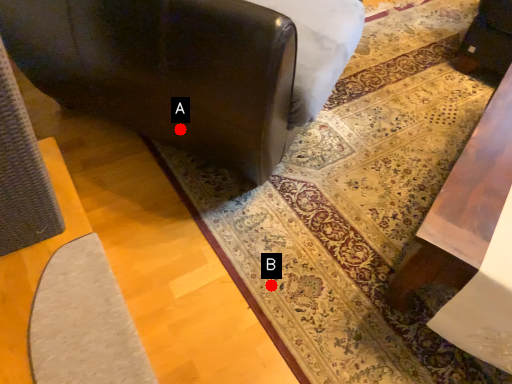
Question: Two points are circled on the image, labeled by A and B beside each circle. Which of the following is the closest to the observer?

Choices:
 (A) A is closer
 (B) B is closer

Answer: (A)